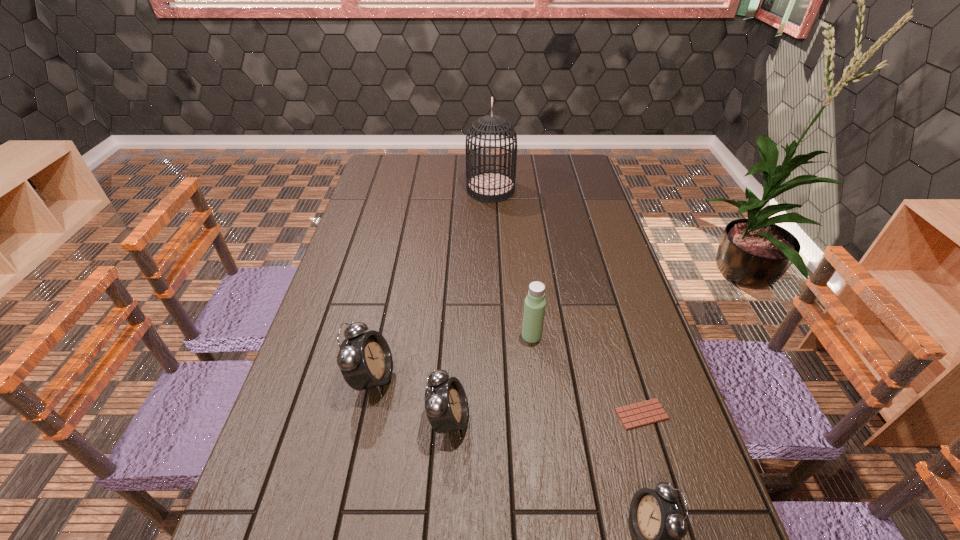
You are a GUI agent. You are given a task and a screenshot of the screen. Output one action in this format:
    pyautogui.click(x=<x>, y=<y>)
    Task: Click on the free space located 0.130m on the left of the candy bar
    This screenshot has height=540, width=960.
    Given the screenshot: What is the action you would take?
    pyautogui.click(x=559, y=414)

The height and width of the screenshot is (540, 960). I want to click on free space located 0.250m on the front of the fifth nearest object, so 542,430.

Where is `object located in the far edge section of the desktop`? The height and width of the screenshot is (540, 960). object located in the far edge section of the desktop is located at coordinates (489, 186).

Identify the location of object that is at the left edge. The width and height of the screenshot is (960, 540). (365, 360).

The height and width of the screenshot is (540, 960). I want to click on object that is at the right edge, so click(x=636, y=415).

Identify the location of vacant region at the far edge of the desktop. pyautogui.click(x=547, y=160).

Where is `vacant region at the near edge of the desktop`? The width and height of the screenshot is (960, 540). vacant region at the near edge of the desktop is located at coordinates (609, 506).

I want to click on free space at the left edge of the desktop, so point(326,467).

At what (x,y) coordinates should I click in order to perform the action: click on free space at the right edge of the desktop. Please return your answer as a coordinate pair (x, y). The image size is (960, 540). Looking at the image, I should click on (577, 200).

In the image, there is a desktop. Where is `blank space at the far left corner`? The height and width of the screenshot is (540, 960). blank space at the far left corner is located at coordinates (385, 165).